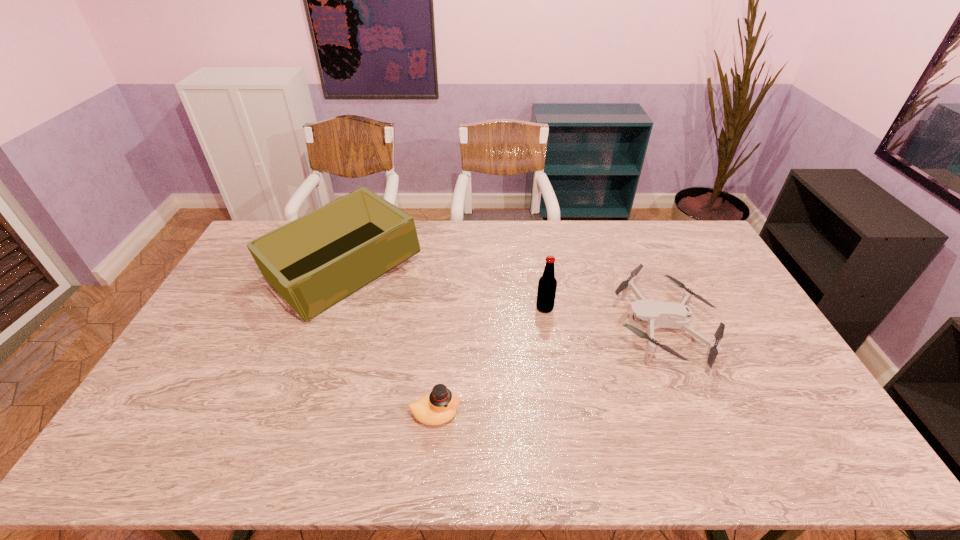
The height and width of the screenshot is (540, 960). In order to click on vacant point located between the drone and the box in this screenshot , I will do `click(503, 299)`.

Where is `free point between the third object from left to right and the drone`? free point between the third object from left to right and the drone is located at coordinates (604, 318).

You are a GUI agent. You are given a task and a screenshot of the screen. Output one action in this format:
    pyautogui.click(x=<x>, y=<y>)
    Task: Click on the vacant space that's between the third object from right to left and the drone
    
    Given the screenshot: What is the action you would take?
    pyautogui.click(x=548, y=370)

Image resolution: width=960 pixels, height=540 pixels. Find the location of `vacant space that is in between the nearest object and the third object from left to right`. vacant space that is in between the nearest object and the third object from left to right is located at coordinates (490, 361).

At what (x,y) coordinates should I click in order to perform the action: click on unoccupied position between the nearest object and the box. Please return your answer as a coordinate pair (x, y). Looking at the image, I should click on (389, 342).

This screenshot has height=540, width=960. In order to click on empty space that is in between the duck and the leftmost object in this screenshot , I will do `click(389, 342)`.

Locate an element on the screen. The width and height of the screenshot is (960, 540). free space between the nearest object and the beer bottle is located at coordinates (490, 361).

Where is `free area in between the third object from right to left and the drone`? free area in between the third object from right to left and the drone is located at coordinates (548, 370).

Identify which object is the second closest to the box. Please provide its 2D coordinates. Your answer should be formatted as a tuple, i.e. [(x, y)], where the tuple contains the x and y coordinates of a point satisfying the conditions above.

[(547, 284)]

Point out which object is positioned as the nearest to the drone. Please provide its 2D coordinates. Your answer should be formatted as a tuple, i.e. [(x, y)], where the tuple contains the x and y coordinates of a point satisfying the conditions above.

[(547, 284)]